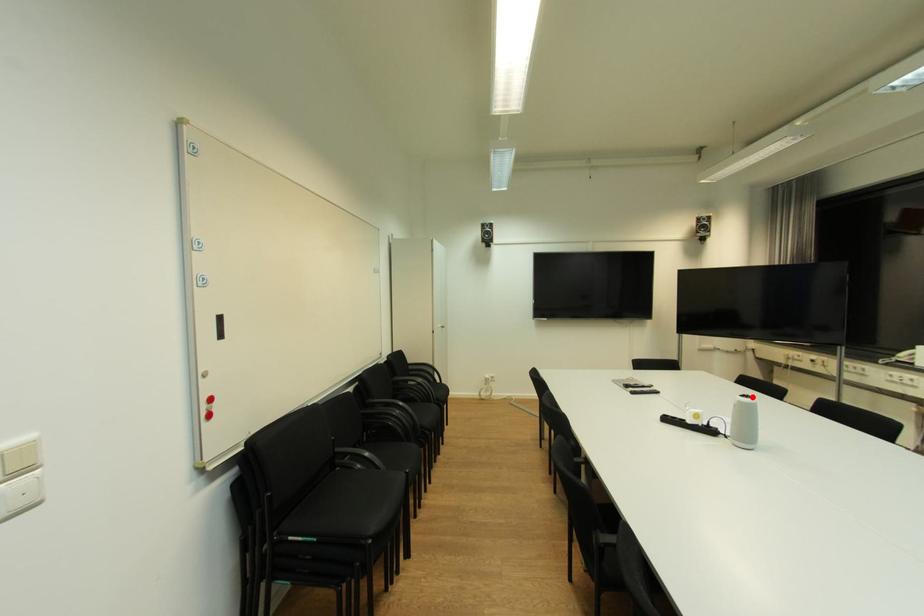
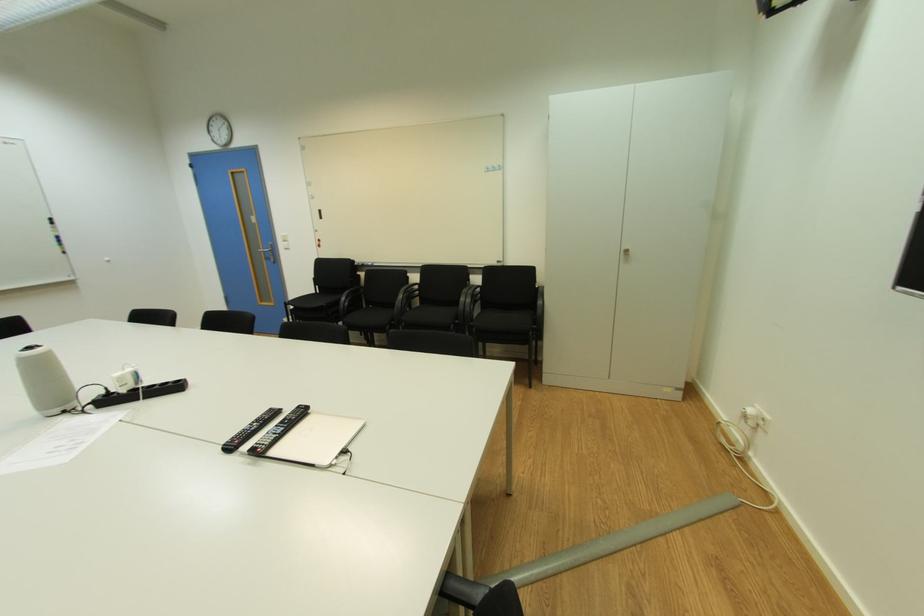
Question: I am providing you with two images of the same scene from different viewpoints. In image1, a red point is highlighted. Considering the same 3D point in image2, which of the following is correct?

Choices:
 (A) It is closer
 (B) It is farther

Answer: (A)